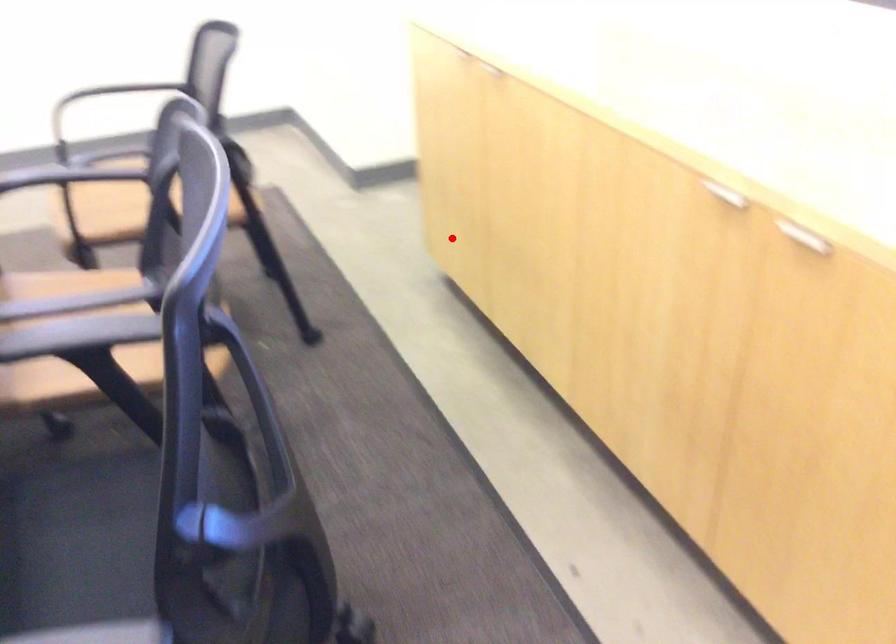
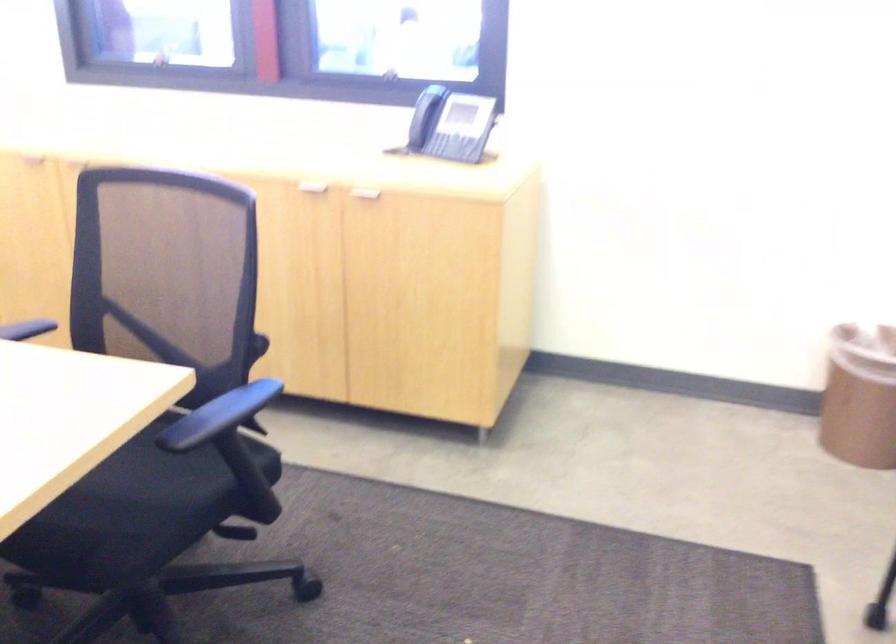
Question: I am providing you with two images of the same scene from different viewpoints. In image1, a red point is highlighted. Considering the same 3D point in image2, which of the following is correct?

Choices:
 (A) It is closer
 (B) It is farther

Answer: (B)